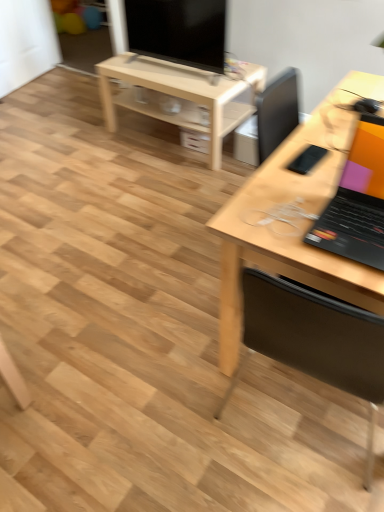
Image resolution: width=384 pixels, height=512 pixels. I want to click on vacant area situated to the left side of light wood desk at right, so click(x=139, y=317).